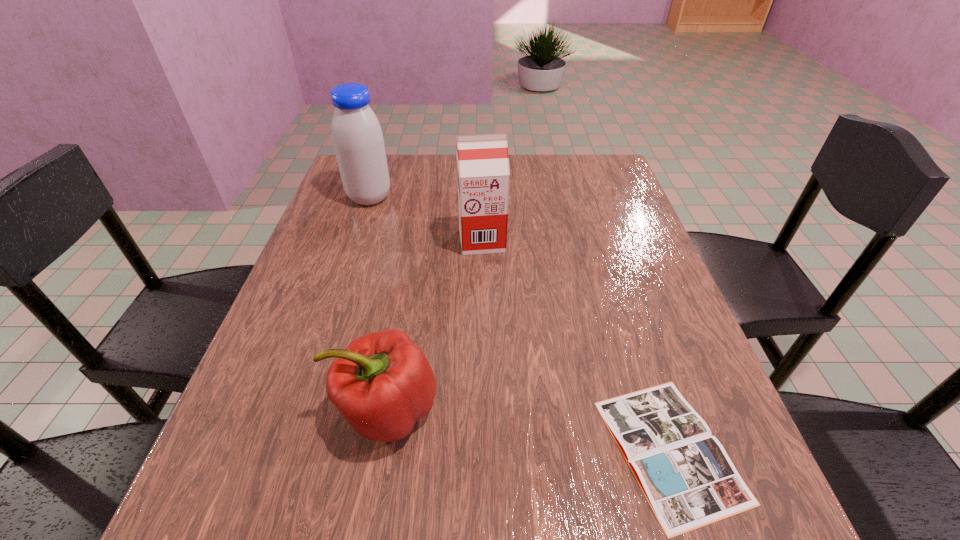
The width and height of the screenshot is (960, 540). In order to click on vacant space located on the left of the book in this screenshot , I will do `click(559, 450)`.

Identify the location of object at the far edge. This screenshot has width=960, height=540. (358, 141).

The height and width of the screenshot is (540, 960). In order to click on object present at the near edge in this screenshot , I will do `click(688, 479)`.

Identify the location of object that is at the left edge. (358, 141).

Find the location of a particular element. object located in the right edge section of the desktop is located at coordinates (688, 479).

Find the location of a particular element. Image resolution: width=960 pixels, height=540 pixels. object at the far left corner is located at coordinates (358, 141).

Locate an element on the screen. The width and height of the screenshot is (960, 540). object that is at the near right corner is located at coordinates tap(688, 479).

The image size is (960, 540). I want to click on blank space at the far edge of the desktop, so click(x=410, y=176).

Find the location of a particular element. vacant space at the near edge of the desktop is located at coordinates (626, 518).

The height and width of the screenshot is (540, 960). I want to click on vacant region at the left edge of the desktop, so click(x=330, y=198).